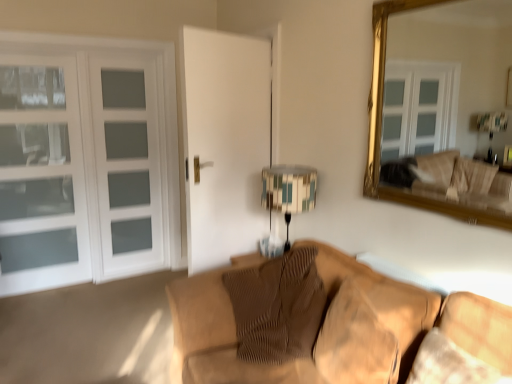
Question: Is brown textured pillow at center in front of or behind textured beige swivel chair at lower right in the image?

Choices:
 (A) behind
 (B) front

Answer: (A)

Question: Is point [x=252, y=286] positioned closer to the camera than point [x=430, y=342]?

Choices:
 (A) closer
 (B) farther

Answer: (B)

Question: Based on their relative distances, which object is nearer to the white glass door at left?

Choices:
 (A) white glass screen door at left
 (B) brown textured pillow at center
 (C) white glass cabinet at left
 (D) patterned fabric lampshade at center
 (E) gold-framed mirror at upper right

Answer: (A)

Question: Which object is positioned closest to the white glass cabinet at left?

Choices:
 (A) white glass screen door at left
 (B) white glass door at left
 (C) patterned fabric lampshade at center
 (D) brown textured pillow at center
 (E) textured beige swivel chair at lower right

Answer: (B)